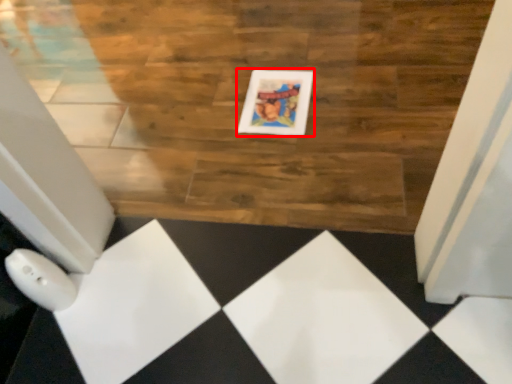
Question: From the image's perspective, what is the correct spatial relationship of picture frame (annotated by the red box) in relation to hardwood?

Choices:
 (A) above
 (B) below

Answer: (B)